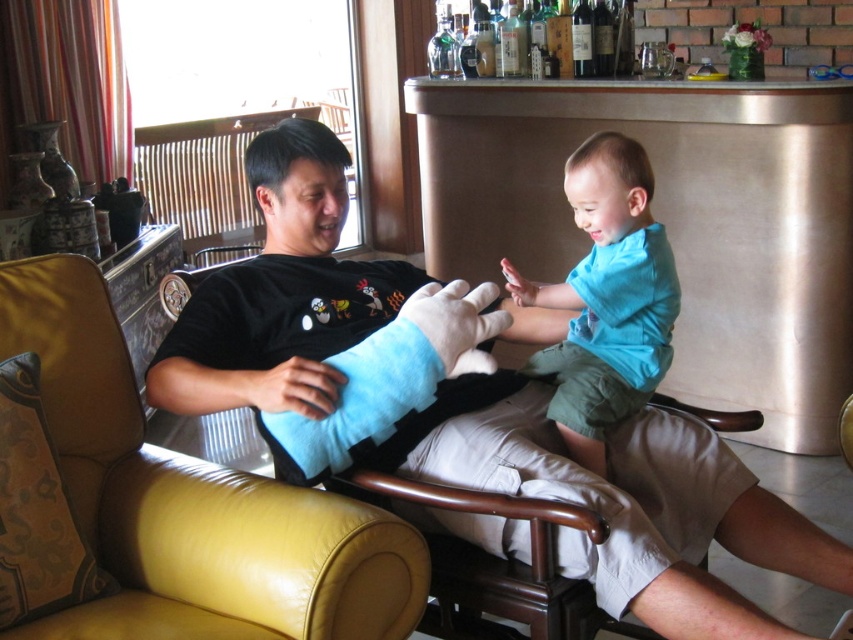
Question: Which of these objects is positioned farthest from the velvet-like yellow pillow at lower left?

Choices:
 (A) yellow leather armchair at left
 (B) blue plush toy at center
 (C) blue soft plush at center

Answer: (B)

Question: Which point appears closest to the camera in this image?

Choices:
 (A) (444, 291)
 (B) (641, 268)
 (C) (332, 196)
 (D) (16, 368)

Answer: (D)

Question: Which point is farther from the camera taking this photo?

Choices:
 (A) (529, 292)
 (B) (390, 323)
 (C) (4, 524)

Answer: (A)

Question: Is blue plush toy at center thinner than blue cotton shirt at upper right?

Choices:
 (A) yes
 (B) no

Answer: (B)

Question: Does blue soft plush at center appear on the right side of velvet-like yellow pillow at lower left?

Choices:
 (A) yes
 (B) no

Answer: (A)

Question: Where is blue plush toy at center located in relation to blue cotton shirt at upper right in the image?

Choices:
 (A) left
 (B) right

Answer: (A)